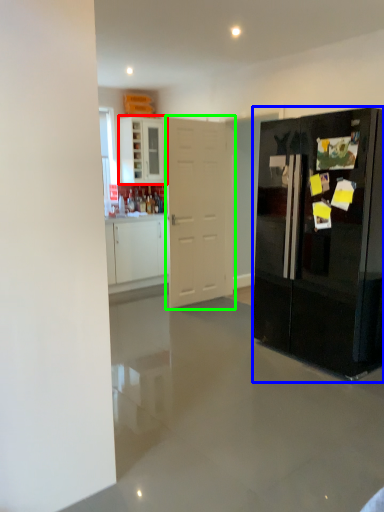
Question: Which object is the farthest from cabinetry (highlighted by a red box)? Choose among these: refrigerator (highlighted by a blue box) or door (highlighted by a green box).

Choices:
 (A) refrigerator
 (B) door

Answer: (A)